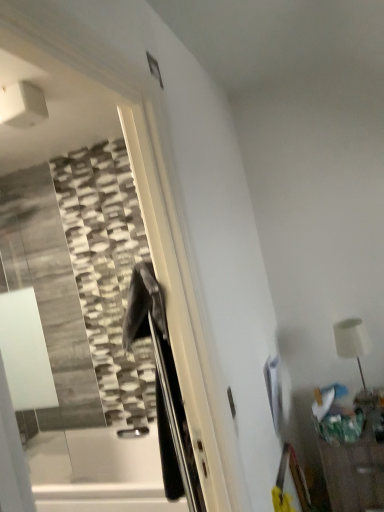
The width and height of the screenshot is (384, 512). What do you see at coordinates (351, 341) in the screenshot?
I see `white matte table lamp at right` at bounding box center [351, 341].

This screenshot has width=384, height=512. In order to click on white matte table lamp at right in this screenshot , I will do `click(351, 341)`.

Measure the distance between white matte table lamp at right and camera.

They are 1.99 meters apart.

Describe the element at coordinates (354, 459) in the screenshot. This screenshot has width=384, height=512. I see `wooden table at lower right` at that location.

Where is `wooden table at lower right`? wooden table at lower right is located at coordinates (354, 459).

At what (x,y) coordinates should I click in order to perform the action: click on white matte table lamp at right. Please return your answer as a coordinate pair (x, y). Image resolution: width=384 pixels, height=512 pixels. Looking at the image, I should click on (351, 341).

Which object is positioned more to the right, white matte table lamp at right or wooden table at lower right?

Positioned to the right is wooden table at lower right.

Is white matte table lamp at right positioned behind wooden table at lower right?

Yes, white matte table lamp at right is further from the viewer.

Is point (358, 345) positioned before point (331, 475)?

No, (358, 345) is further to viewer.

From the image's perspective, is white matte table lamp at right positioned above or below wooden table at lower right?

From the image's perspective, white matte table lamp at right appears above wooden table at lower right.

From a real-world perspective, relative to wooden table at lower right, is white matte table lamp at right vertically above or below?

In terms of real-world spatial position, white matte table lamp at right is above wooden table at lower right.

Considering the relative sizes of white matte table lamp at right and wooden table at lower right in the image provided, is white matte table lamp at right wider than wooden table at lower right?

Incorrect, the width of white matte table lamp at right does not surpass that of wooden table at lower right.

Which of these two, white matte table lamp at right or wooden table at lower right, stands shorter?

Standing shorter between the two is white matte table lamp at right.

Which of these two, white matte table lamp at right or wooden table at lower right, is bigger?

Bigger between the two is wooden table at lower right.

Is white matte table lamp at right inside or outside of wooden table at lower right?

The correct answer is: outside.

Consider the image. Is white matte table lamp at right not close to wooden table at lower right?

white matte table lamp at right is near wooden table at lower right, not far away.

Is white matte table lamp at right oriented away from wooden table at lower right?

No, white matte table lamp at right's orientation is not away from wooden table at lower right.

Can you tell me how much white matte table lamp at right and wooden table at lower right differ in facing direction?

The angular difference between white matte table lamp at right and wooden table at lower right is 0.000406 degrees.

This screenshot has width=384, height=512. I want to click on furniture in front of the white matte table lamp at right, so click(x=354, y=459).

Is wooden table at lower right at the left side of white matte table lamp at right?

In fact, wooden table at lower right is to the right of white matte table lamp at right.

Which object is closer to the camera taking this photo, wooden table at lower right or white matte table lamp at right?

wooden table at lower right.

Considering the positions of points (354, 497) and (347, 343), is point (354, 497) farther from camera compared to point (347, 343)?

No, (354, 497) is in front of (347, 343).

From the image's perspective, does wooden table at lower right appear higher than white matte table lamp at right?

Actually, wooden table at lower right appears below white matte table lamp at right in the image.

From a real-world perspective, which is physically below, wooden table at lower right or white matte table lamp at right?

wooden table at lower right.

Does wooden table at lower right have a lesser width compared to white matte table lamp at right?

No.

Considering the relative sizes of wooden table at lower right and white matte table lamp at right in the image provided, is wooden table at lower right taller than white matte table lamp at right?

Correct, wooden table at lower right is much taller as white matte table lamp at right.

Who is bigger, wooden table at lower right or white matte table lamp at right?

With larger size is wooden table at lower right.

Is white matte table lamp at right a part of wooden table at lower right?

No, white matte table lamp at right is not inside wooden table at lower right.

Is wooden table at lower right far away from white matte table lamp at right?

Actually, wooden table at lower right and white matte table lamp at right are a little close together.

Could you tell me if wooden table at lower right is turned towards white matte table lamp at right?

No, wooden table at lower right is not aimed at white matte table lamp at right.

How much distance is there between wooden table at lower right and white matte table lamp at right?

They are 17.07 inches apart.

At what (x,y) coordinates should I click in order to perform the action: click on table lamp that is above the wooden table at lower right (from a real-world perspective). Please return your answer as a coordinate pair (x, y). Looking at the image, I should click on (351, 341).

The image size is (384, 512). Identify the location of furniture that appears in front of the white matte table lamp at right. (354, 459).

Locate an element on the screen. The image size is (384, 512). table lamp that appears behind the wooden table at lower right is located at coordinates (351, 341).